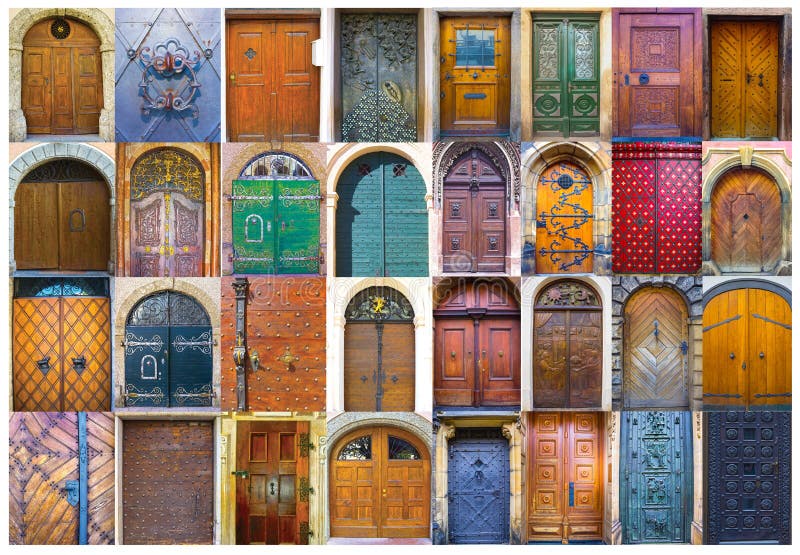
Locate an element on the screen. Image resolution: width=800 pixels, height=555 pixels. individual doors in first column from the left and also in first column from the right is located at coordinates (765, 460), (756, 336), (752, 211), (752, 108), (48, 94), (56, 213), (44, 333), (36, 448).